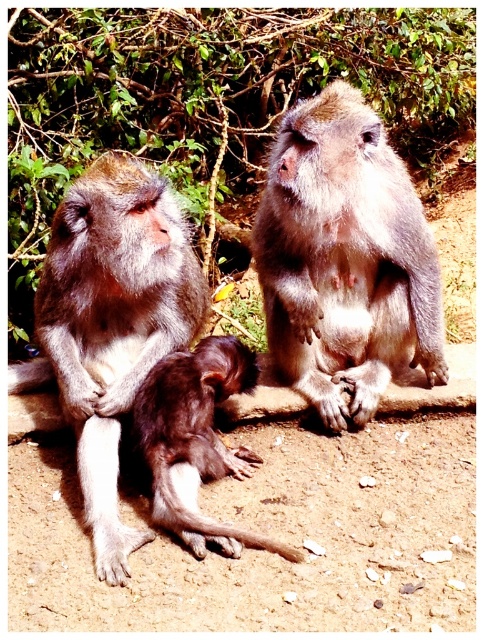
Is gray furry monkey at center above gray furry monkey at left?

Yes, gray furry monkey at center is above gray furry monkey at left.

Is point (291, 288) closer to viewer compared to point (136, 540)?

No, it is not.

Is point (288, 278) in front of point (178, 262)?

No, it is behind (178, 262).

This screenshot has height=640, width=484. What are the coordinates of `gray furry monkey at center` in the screenshot? It's located at (345, 259).

Which of these two, gray furry monkey at left or dark brown fur monkey at center, stands shorter?

With less height is dark brown fur monkey at center.

Between gray furry monkey at left and dark brown fur monkey at center, which one appears on the right side from the viewer's perspective?

dark brown fur monkey at center is more to the right.

Is point (56, 352) more distant than point (235, 340)?

No, it is in front of (235, 340).

The height and width of the screenshot is (640, 484). Find the location of `gray furry monkey at left`. gray furry monkey at left is located at coordinates (110, 323).

Which is more to the right, gray furry monkey at center or dark brown fur monkey at center?

gray furry monkey at center is more to the right.

Between point (398, 291) and point (208, 467), which one is positioned in front?

Point (208, 467) is more forward.

Between point (392, 276) and point (174, 477), which one is positioned in front?

Positioned in front is point (174, 477).

Find the location of a particular element. This screenshot has width=484, height=640. gray furry monkey at center is located at coordinates (345, 259).